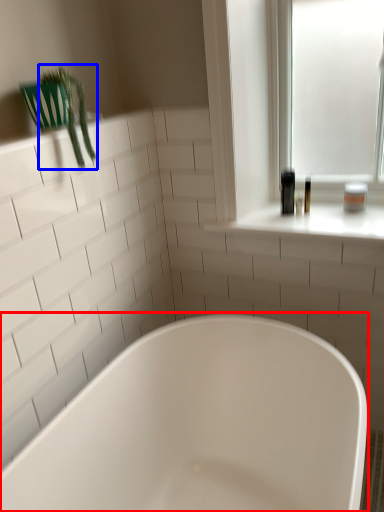
Question: Which point is further to the camera, bathtub (highlighted by a red box) or plant (highlighted by a blue box)?

Choices:
 (A) bathtub
 (B) plant

Answer: (B)